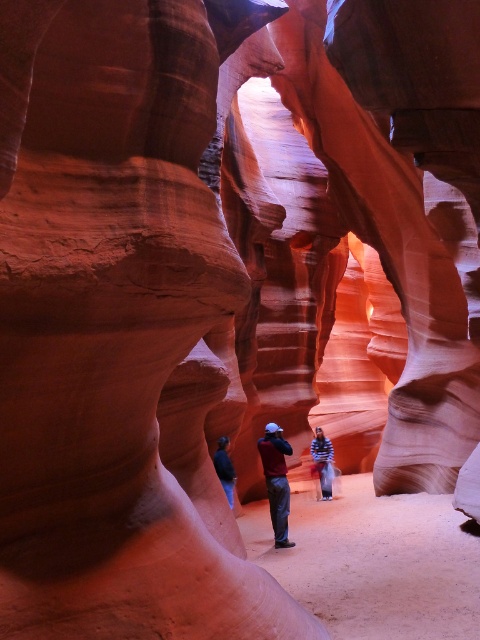
Between striped shirt at center and dark blue jeans at center, which one has less height?

dark blue jeans at center

Is point (320, 433) farther from viewer compared to point (231, 476)?

Yes, it is behind point (231, 476).

Where is `striped shirt at center`? This screenshot has width=480, height=640. striped shirt at center is located at coordinates (322, 461).

Measure the distance between maroon fabric shirt at center and camera.

maroon fabric shirt at center is 25.69 feet away from camera.

Does point (267, 490) come in front of point (227, 492)?

That is True.

Find the location of `maroon fabric shirt at center`. maroon fabric shirt at center is located at coordinates (276, 481).

Is point (272, 500) positioned before point (315, 458)?

Yes, it is.

Does maroon fabric shirt at center have a lesser height compared to striped shirt at center?

Indeed, maroon fabric shirt at center has a lesser height compared to striped shirt at center.

The image size is (480, 640). Identify the location of maroon fabric shirt at center. (276, 481).